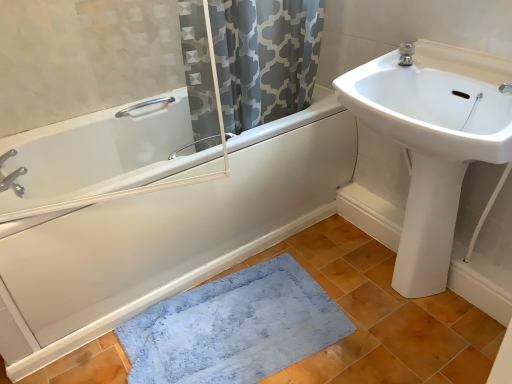
Image resolution: width=512 pixels, height=384 pixels. Identify the location of free space between white glossy bathtub at left and white glossy bidet at right. (274, 294).